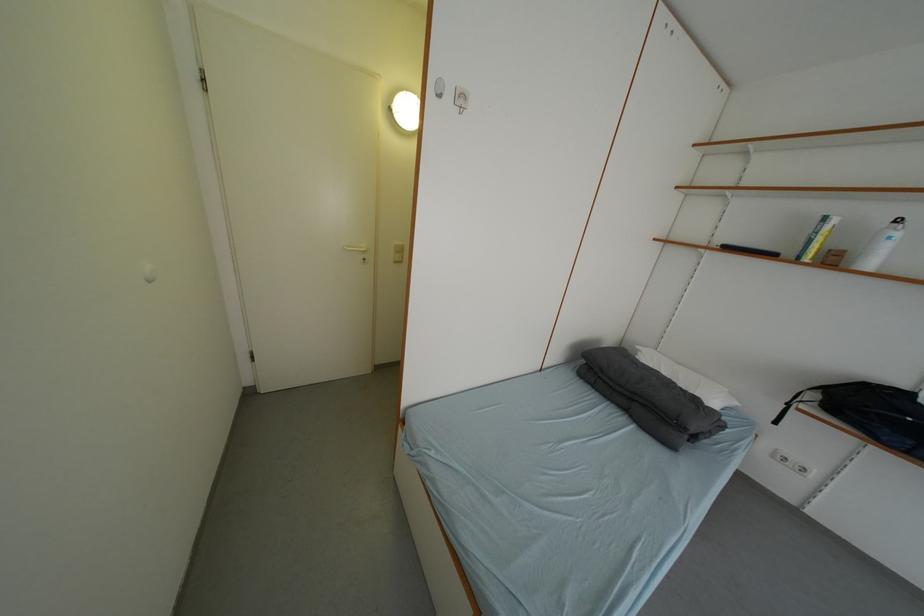
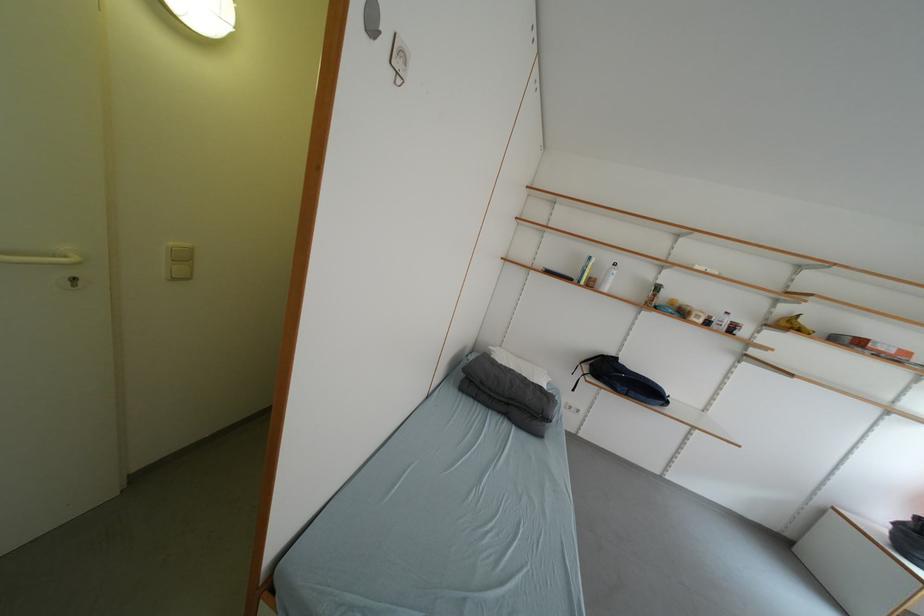
Where in the second image is the point corresponding to (x=408, y=254) from the first image?

(191, 261)